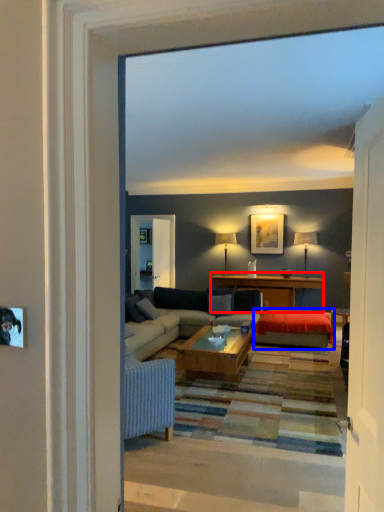
Question: Which object is further to the camera taking this photo, table (highlighted by a red box) or wide (highlighted by a blue box)?

Choices:
 (A) table
 (B) wide

Answer: (A)